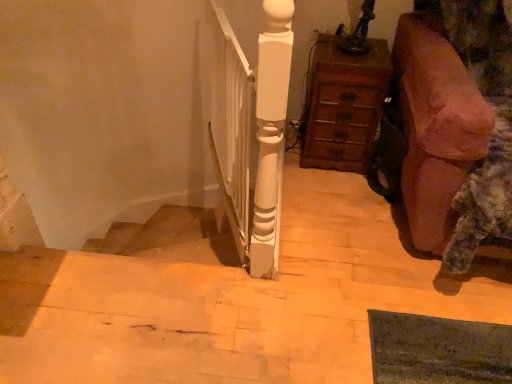
Find the location of `vacant space situated above wooden chest of drawers at right (from a real-world perspective)`. vacant space situated above wooden chest of drawers at right (from a real-world perspective) is located at coordinates (360, 45).